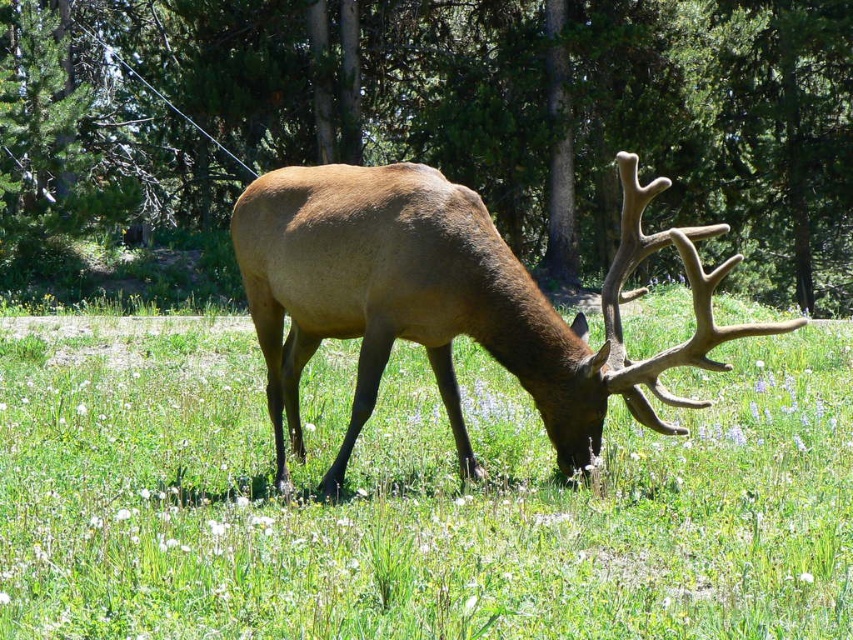
Question: Is green grass at center positioned in front of brown matte tree at center?

Choices:
 (A) no
 (B) yes

Answer: (B)

Question: Does green grass at center have a lesser width compared to brown velvet deer at center?

Choices:
 (A) no
 (B) yes

Answer: (B)

Question: Among these objects, which one is nearest to the camera?

Choices:
 (A) brown velvet deer at center
 (B) brown matte tree at center
 (C) green grass at center

Answer: (A)

Question: Which of these objects is positioned closest to the brown velvet deer at center?

Choices:
 (A) green grass at center
 (B) brown matte tree at center

Answer: (A)

Question: Observing the image, what is the correct spatial positioning of brown matte tree at center in reference to brown velvet deer at center?

Choices:
 (A) below
 (B) above

Answer: (B)

Question: Which point is closer to the camera?

Choices:
 (A) green grass at center
 (B) brown velvet deer at center

Answer: (B)